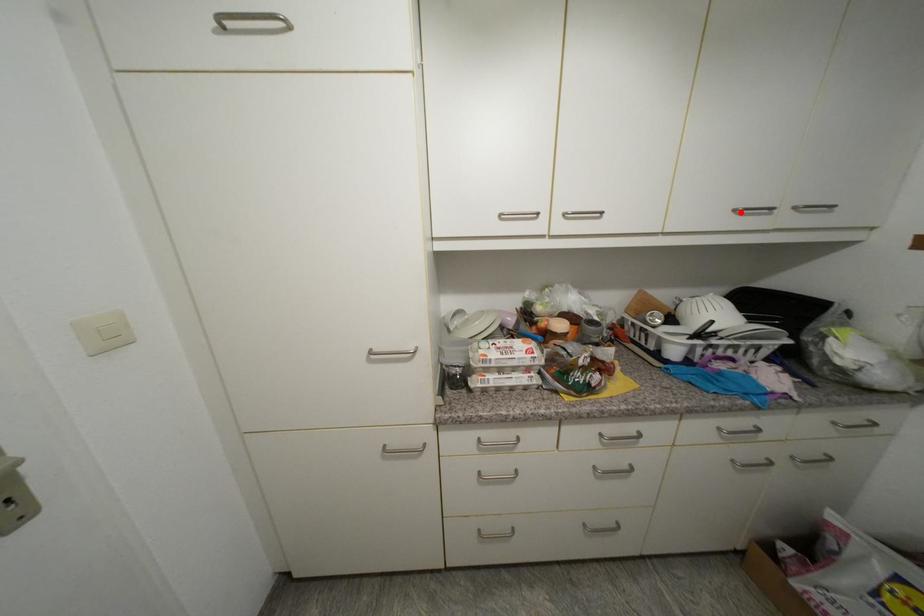
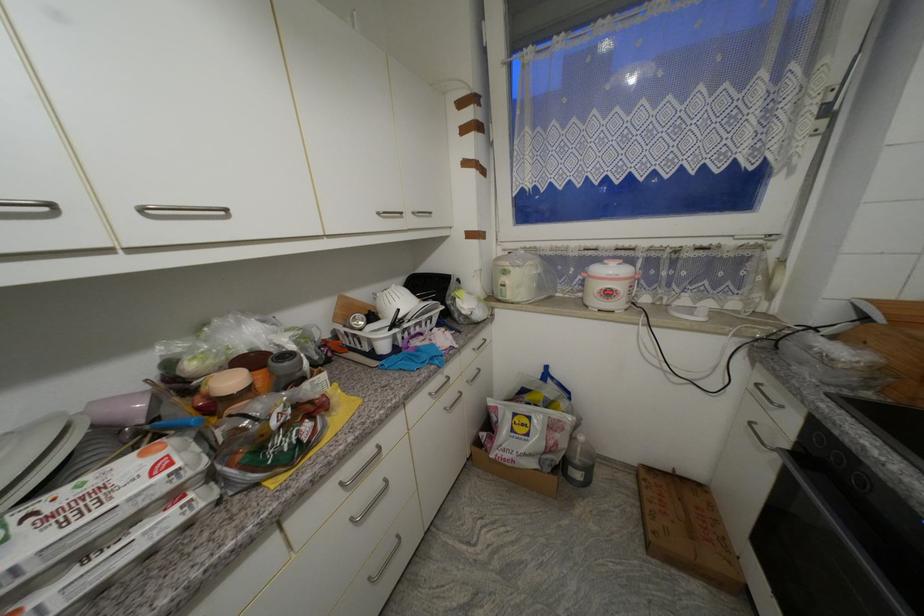
The point at the highlighted location is marked in the first image. Where is the corresponding point in the second image?

(383, 215)